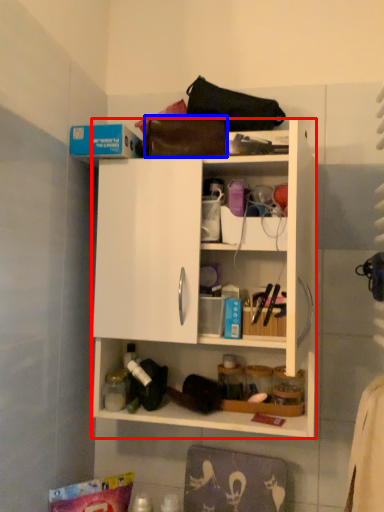
Question: Among these objects, which one is farthest to the camera, cabinetry (highlighted by a red box) or handbag (highlighted by a blue box)?

Choices:
 (A) cabinetry
 (B) handbag

Answer: (B)